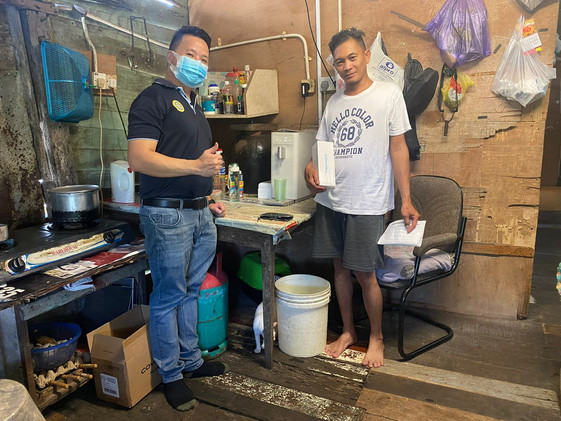
The height and width of the screenshot is (421, 561). What are the coordinates of `arm rest on chair` in the screenshot? It's located at pos(439,236).